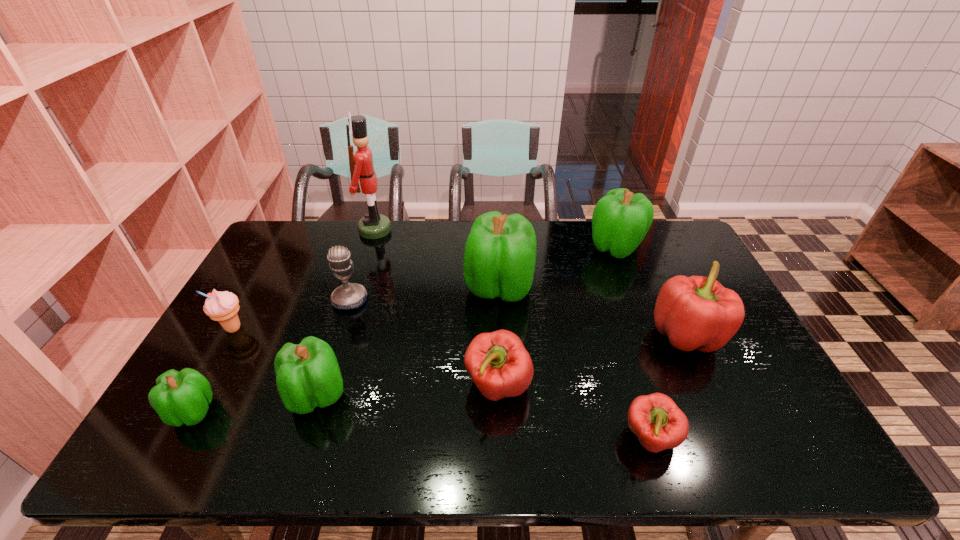
The height and width of the screenshot is (540, 960). In order to click on free point located 0.230m on the right of the third biggest green bell pepper in this screenshot , I will do `click(440, 395)`.

Where is `vacant position located 0.080m on the back of the second biggest pink bell pepper`? The width and height of the screenshot is (960, 540). vacant position located 0.080m on the back of the second biggest pink bell pepper is located at coordinates (496, 338).

This screenshot has width=960, height=540. Find the location of `vacant space located 0.360m on the front of the icecream`. vacant space located 0.360m on the front of the icecream is located at coordinates (156, 464).

Find the location of a particular element. Image resolution: width=960 pixels, height=540 pixels. vacant point located on the right of the smallest green bell pepper is located at coordinates (348, 411).

In order to click on free location located on the back of the smallest pink bell pepper in this screenshot , I will do coord(611,311).

Identify the location of nutcracker present at the far edge. This screenshot has width=960, height=540. (373, 225).

This screenshot has height=540, width=960. In order to click on bell pepper located at the far edge in this screenshot , I will do `click(621, 219)`.

The image size is (960, 540). Find the location of `icecream that is at the left edge`. icecream that is at the left edge is located at coordinates (220, 306).

The height and width of the screenshot is (540, 960). What are the coordinates of `bell pepper at the left edge` in the screenshot? It's located at (183, 397).

Identify the location of object that is at the right edge. The width and height of the screenshot is (960, 540). (696, 312).